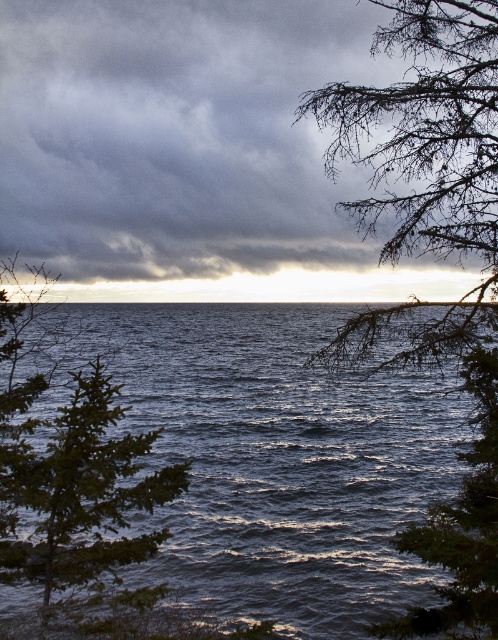
How far apart are dark gray cloud at upper center and dark blue water at center?

11.68 meters

Does dark gray cloud at upper center have a lesser height compared to dark blue water at center?

Incorrect, dark gray cloud at upper center's height does not fall short of dark blue water at center's.

Identify the location of dark gray cloud at upper center. This screenshot has height=640, width=498. (178, 134).

Looking at this image, is dark blue water at center thinner than green textured branches at upper right?

No, dark blue water at center is not thinner than green textured branches at upper right.

Can you confirm if dark blue water at center is positioned above green textured branches at upper right?

Actually, dark blue water at center is below green textured branches at upper right.

Is point (316, 403) closer to camera compared to point (472, 481)?

No, (316, 403) is behind (472, 481).

Locate an element on the screen. This screenshot has width=498, height=640. dark blue water at center is located at coordinates (279, 460).

Can you confirm if dark gray cloud at upper center is thinner than green textured branches at upper right?

Incorrect, dark gray cloud at upper center's width is not less than green textured branches at upper right's.

Consider the image. Between dark gray cloud at upper center and green textured branches at upper right, which one appears on the left side from the viewer's perspective?

Positioned to the left is dark gray cloud at upper center.

Measure the distance between point (9, 192) and camera.

They are 191.31 feet apart.

Find the location of a particular element. This screenshot has width=498, height=640. dark gray cloud at upper center is located at coordinates (178, 134).